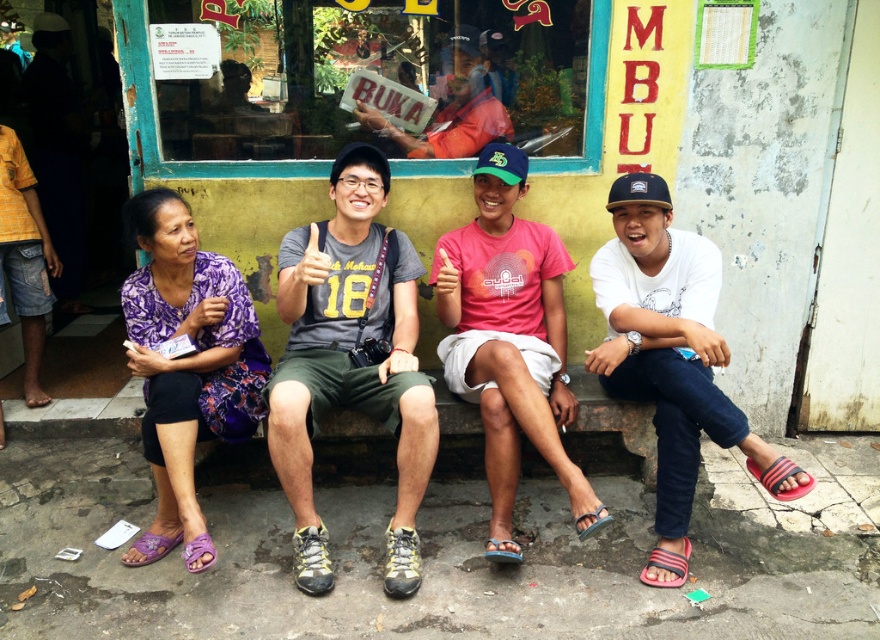
Who is higher up, pink cotton shirt at center or matte orange shirt at upper center?

matte orange shirt at upper center is higher up.

Find the location of `pink cotton shirt at center`. pink cotton shirt at center is located at coordinates (510, 339).

Does point (206, 337) come in front of point (433, 141)?

That is True.

Locate an element on the screen. purple printed dress at lower left is located at coordinates (186, 364).

Which is more to the right, gray fabric shirt at center or matte orange shirt at upper center?

Positioned to the right is matte orange shirt at upper center.

Who is higher up, gray fabric shirt at center or matte orange shirt at upper center?

matte orange shirt at upper center is higher up.

Is point (301, 234) positioned behind point (460, 129)?

No, (301, 234) is closer to viewer.

Locate an element on the screen. This screenshot has height=640, width=880. gray fabric shirt at center is located at coordinates (352, 360).